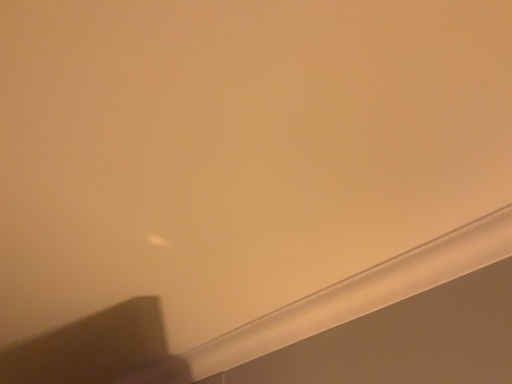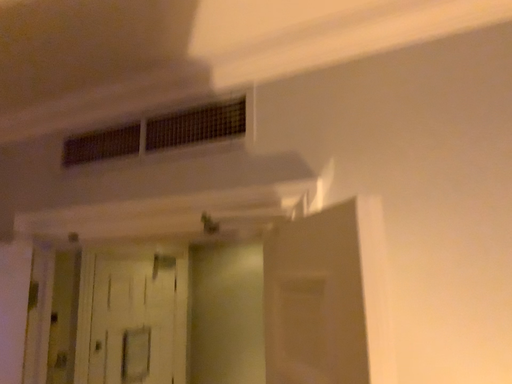
Question: Which way did the camera rotate in the video?

Choices:
 (A) rotated downward
 (B) rotated upward

Answer: (A)